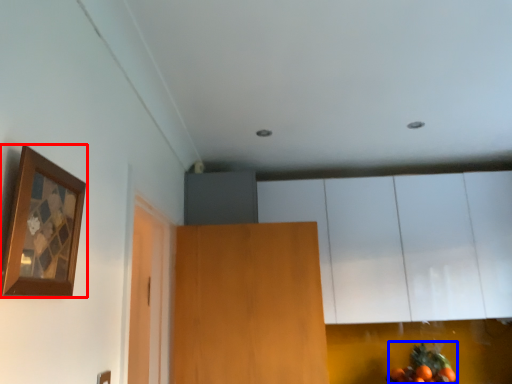
Question: Which of the following is the closest to the observer, picture frame (highlighted by a red box) or fruit (highlighted by a blue box)?

Choices:
 (A) picture frame
 (B) fruit

Answer: (A)